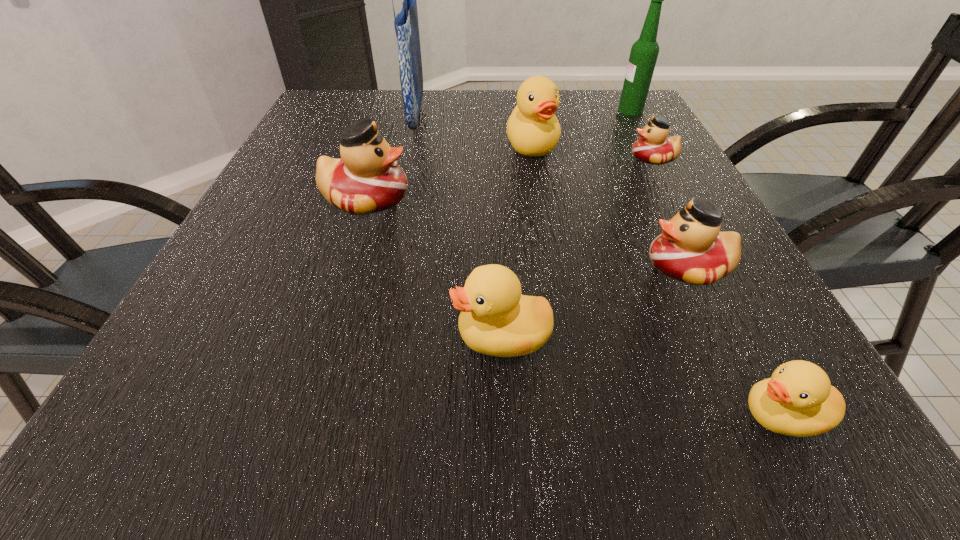
Locate an element on the screen. the farthest red duck is located at coordinates point(654,146).

The image size is (960, 540). What are the coordinates of `the smallest yellow duck` in the screenshot? It's located at (798, 400).

Locate an element on the screen. the rightmost yellow duck is located at coordinates click(798, 400).

The width and height of the screenshot is (960, 540). I want to click on vacant position located 0.130m on the front-facing side of the tallest object, so click(474, 113).

Identify the location of vacant space located on the label of the beer bottle. The image size is (960, 540). (556, 110).

The width and height of the screenshot is (960, 540). I want to click on vacant space located on the label of the beer bottle, so click(x=592, y=110).

Identify the location of vacant area situated on the label of the beer bottle. (574, 110).

Image resolution: width=960 pixels, height=540 pixels. In order to click on vacant area situated 0.210m on the face of the second farthest red duck in this screenshot , I will do `click(513, 198)`.

Locate an element on the screen. This screenshot has height=540, width=960. vacant space located at the beak of the farthest yellow duck is located at coordinates (544, 215).

Find the location of `vacant region located on the face of the third nearest object`. vacant region located on the face of the third nearest object is located at coordinates (524, 267).